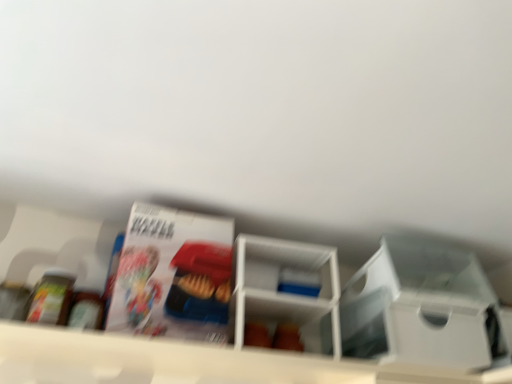
Question: Is white plastic shelf at center, positioned as the second shelf in left-to-right order, surrounding white plastic shelf at center, the second shelf from the right?

Choices:
 (A) no
 (B) yes

Answer: (A)

Question: Does white plastic shelf at center, positioned as the second shelf in left-to-right order, have a lesser height compared to white plastic shelf at center, the second shelf from the right?

Choices:
 (A) no
 (B) yes

Answer: (A)

Question: Is white plastic shelf at center, positioned as the second shelf in left-to-right order, in front of white plastic shelf at center, the second shelf from the right?

Choices:
 (A) no
 (B) yes

Answer: (A)

Question: From a real-world perspective, is white plastic shelf at center, positioned as the second shelf in left-to-right order, positioned over white plastic shelf at center, placed as the first shelf when sorted from left to right, based on gravity?

Choices:
 (A) no
 (B) yes

Answer: (B)

Question: From the image's perspective, is white plastic shelf at center, which is counted as the first shelf, starting from the right, on top of white plastic shelf at center, placed as the first shelf when sorted from left to right?

Choices:
 (A) no
 (B) yes

Answer: (B)

Question: Which is correct: white plastic storage box at center-right is inside white plastic shelf at center, positioned as the second shelf in left-to-right order, or outside of it?

Choices:
 (A) inside
 (B) outside

Answer: (B)

Question: Based on their positions, is white plastic storage box at center-right located to the left or right of white plastic shelf at center, positioned as the second shelf in left-to-right order?

Choices:
 (A) left
 (B) right

Answer: (B)

Question: Considering the positions of white plastic storage box at center-right and white plastic shelf at center, positioned as the second shelf in left-to-right order, in the image, is white plastic storage box at center-right bigger or smaller than white plastic shelf at center, positioned as the second shelf in left-to-right order,?

Choices:
 (A) small
 (B) big

Answer: (A)

Question: Considering the positions of point (459, 319) and point (296, 278), is point (459, 319) closer or farther from the camera than point (296, 278)?

Choices:
 (A) farther
 (B) closer

Answer: (B)

Question: Does point (244, 332) appear closer or farther from the camera than point (144, 316)?

Choices:
 (A) farther
 (B) closer

Answer: (A)

Question: From the image's perspective, is white plastic shelf at center, which is counted as the first shelf, starting from the right, located above or below white glossy magazine at upper center?

Choices:
 (A) below
 (B) above

Answer: (A)

Question: Is white plastic shelf at center, which is counted as the first shelf, starting from the right, taller or shorter than white glossy magazine at upper center?

Choices:
 (A) tall
 (B) short

Answer: (B)

Question: From a real-world perspective, is white plastic shelf at center, which is counted as the first shelf, starting from the right, above or below white glossy magazine at upper center?

Choices:
 (A) below
 (B) above

Answer: (A)

Question: From a real-world perspective, is white glossy magazine at upper center above or below white plastic shelf at center, placed as the first shelf when sorted from left to right?

Choices:
 (A) above
 (B) below

Answer: (A)

Question: Is point (145, 319) closer or farther from the camera than point (499, 380)?

Choices:
 (A) farther
 (B) closer

Answer: (B)